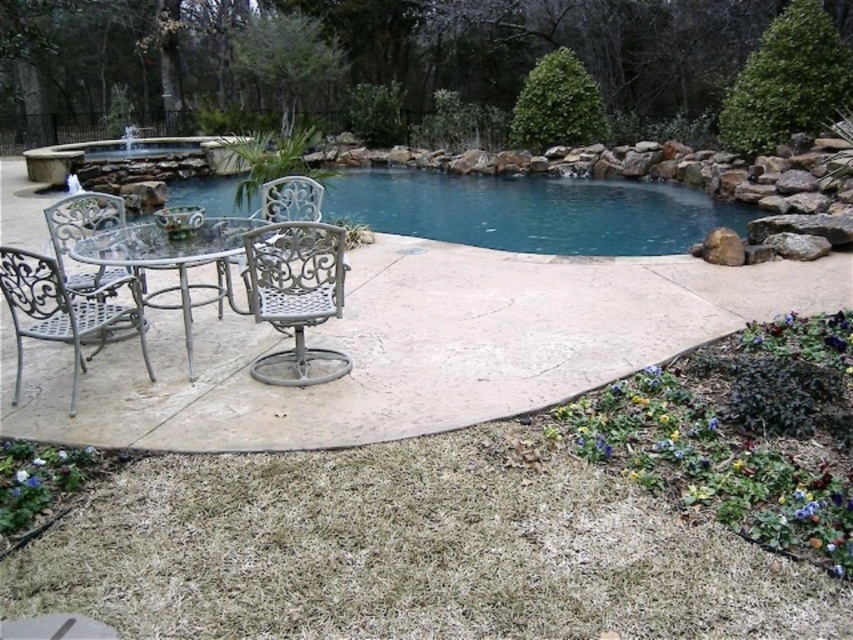
What do you see at coordinates (296, 296) in the screenshot?
I see `metallic silver chair at center` at bounding box center [296, 296].

Which of these two, metallic silver chair at center or silver wrought iron chair at lower left, stands shorter?

silver wrought iron chair at lower left is shorter.

This screenshot has height=640, width=853. What are the coordinates of `metallic silver chair at center` in the screenshot? It's located at (296, 296).

Which of these two, silver wrought iron chair at lower left or white wrought iron chair at center, stands taller?

With more height is silver wrought iron chair at lower left.

Is point (129, 305) positioned before point (265, 198)?

Yes.

The width and height of the screenshot is (853, 640). Find the location of `silver wrought iron chair at lower left`. silver wrought iron chair at lower left is located at coordinates (61, 310).

Is clear glass pond at center to the right of silver wrought iron chair at lower left from the viewer's perspective?

Yes, clear glass pond at center is to the right of silver wrought iron chair at lower left.

Does clear glass pond at center lie behind silver wrought iron chair at lower left?

Yes.

Is point (729, 205) farther from viewer compared to point (85, 320)?

Yes, it is.

I want to click on clear glass pond at center, so click(x=531, y=211).